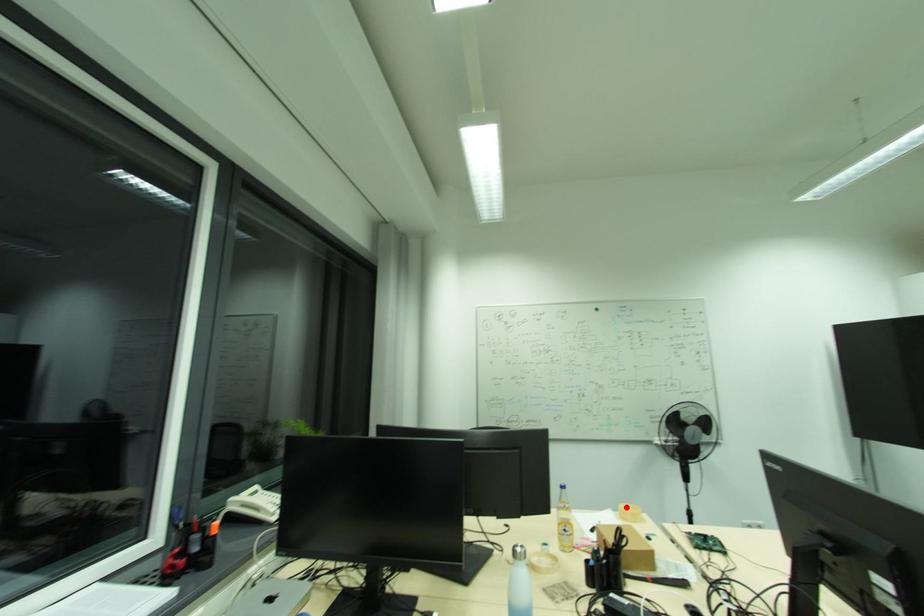
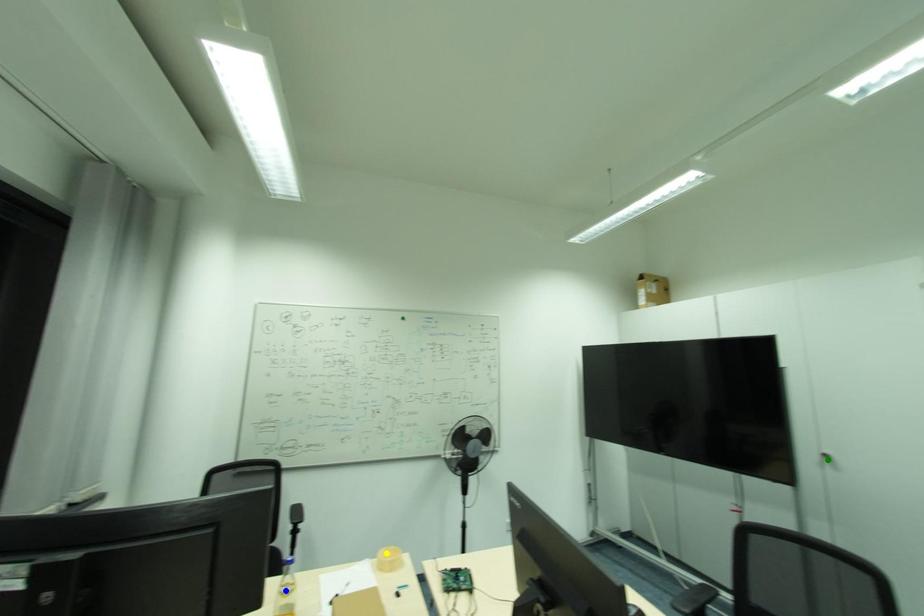
Question: I am providing you with two images of the same scene from different viewpoints. A red point is marked on the first image. You are given multiple points on the second image. Which spot in image 2 lines up with the point in image 1?

Choices:
 (A) green point
 (B) blue point
 (C) yellow point

Answer: (C)